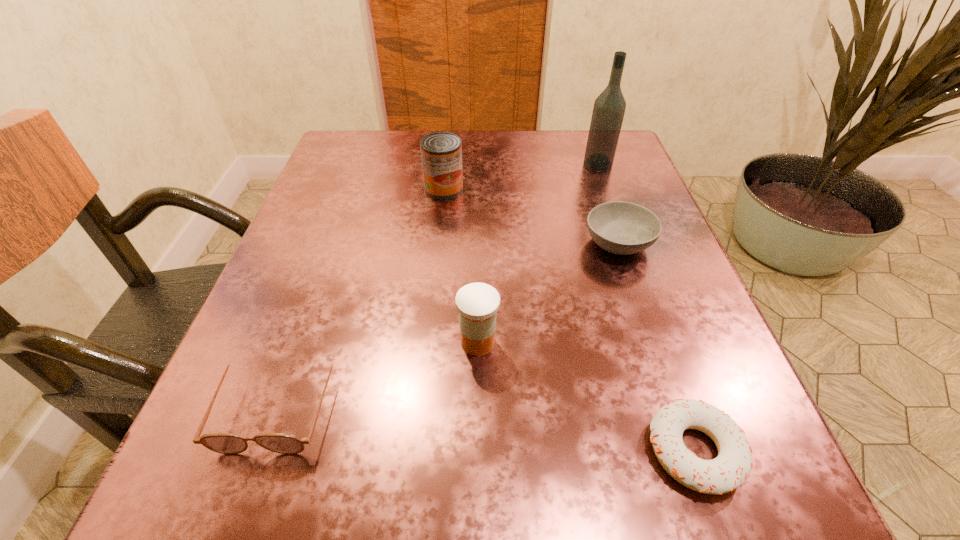
This screenshot has height=540, width=960. Identify the location of doughnut at the right edge. (731, 468).

Locate an element on the screen. This screenshot has width=960, height=540. object that is at the near left corner is located at coordinates (224, 443).

This screenshot has height=540, width=960. I want to click on object that is at the far right corner, so click(609, 108).

Where is `object that is at the near right corner`? object that is at the near right corner is located at coordinates (731, 468).

This screenshot has height=540, width=960. In the image, there is a desktop. What are the coordinates of `blank space at the far edge` in the screenshot? It's located at point(496,143).

Find the location of a particular element. The image size is (960, 540). vacant space at the near edge is located at coordinates (420, 538).

The height and width of the screenshot is (540, 960). Identify the location of vacant space at the left edge of the desktop. (x=362, y=272).

This screenshot has width=960, height=540. In order to click on free spot at the right edge of the desktop in this screenshot , I will do `click(659, 260)`.

In the image, there is a desktop. Where is `free space at the far left corner`? Image resolution: width=960 pixels, height=540 pixels. free space at the far left corner is located at coordinates (372, 137).

I want to click on free spot at the near left corner of the desktop, so click(266, 511).